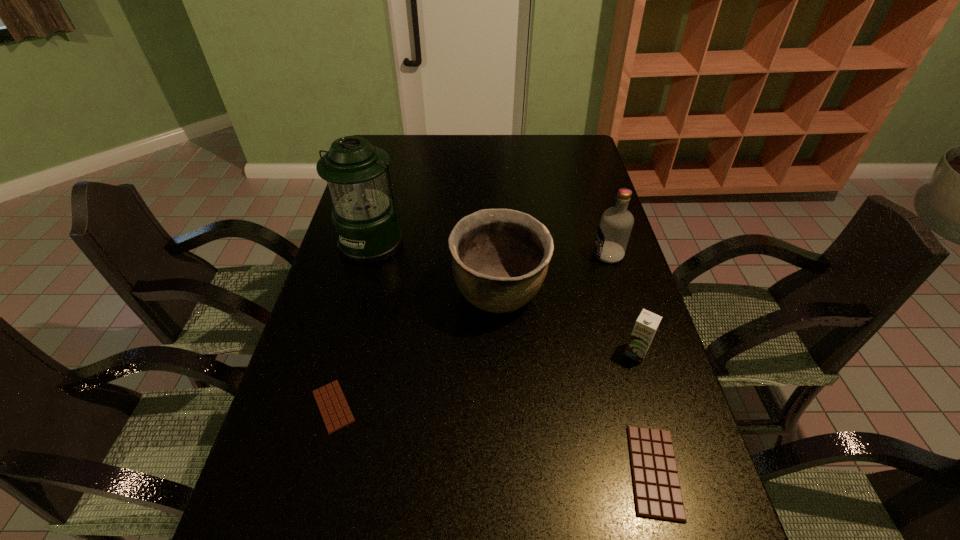
Image resolution: width=960 pixels, height=540 pixels. I want to click on candy bar located in the right edge section of the desktop, so click(657, 492).

Find the location of `chocolate milk present at the right edge`. chocolate milk present at the right edge is located at coordinates [x=646, y=325].

Locate an element on the screen. This screenshot has width=960, height=540. vodka present at the right edge is located at coordinates (615, 227).

Image resolution: width=960 pixels, height=540 pixels. What are the coordinates of `object located at the near right corner` in the screenshot? It's located at (657, 492).

The width and height of the screenshot is (960, 540). Find the location of `free spot at the far edge of the desktop`. free spot at the far edge of the desktop is located at coordinates (532, 154).

I want to click on free space at the near edge of the desktop, so click(x=536, y=485).

In the image, there is a desktop. Identify the location of free space at the left edge. (346, 280).

Locate an element on the screen. This screenshot has height=540, width=960. blank space at the right edge of the desktop is located at coordinates (687, 452).

In the image, there is a desktop. Find the location of `vacant space at the far right corner`. vacant space at the far right corner is located at coordinates (570, 163).

Where is `vacant area that lies between the third nearest object and the vodka`? vacant area that lies between the third nearest object and the vodka is located at coordinates (622, 303).